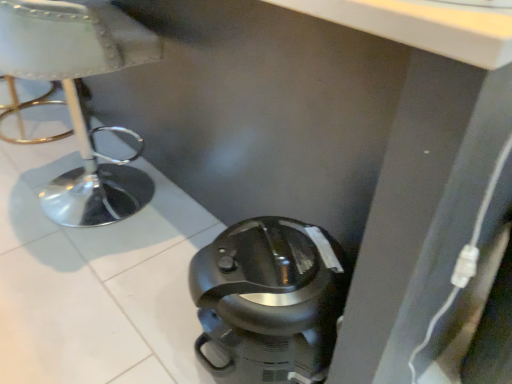
Question: Is white leather stool at left located outside black plastic coffee pot at lower center?

Choices:
 (A) yes
 (B) no

Answer: (A)

Question: Is white leather stool at left in front of black plastic coffee pot at lower center?

Choices:
 (A) yes
 (B) no

Answer: (B)

Question: Would you say white leather stool at left contains black plastic coffee pot at lower center?

Choices:
 (A) yes
 (B) no

Answer: (B)

Question: Is white leather stool at left thinner than black plastic coffee pot at lower center?

Choices:
 (A) yes
 (B) no

Answer: (B)

Question: Does white leather stool at left have a greater height compared to black plastic coffee pot at lower center?

Choices:
 (A) no
 (B) yes

Answer: (B)

Question: Is white leather stool at left turned away from black plastic coffee pot at lower center?

Choices:
 (A) yes
 (B) no

Answer: (B)

Question: Is black plastic coffee pot at lower center directly adjacent to white leather stool at left?

Choices:
 (A) no
 (B) yes

Answer: (A)

Question: Can you confirm if black plastic coffee pot at lower center is thinner than white leather stool at left?

Choices:
 (A) yes
 (B) no

Answer: (A)

Question: From a real-world perspective, is black plastic coffee pot at lower center located beneath white leather stool at left?

Choices:
 (A) no
 (B) yes

Answer: (B)

Question: Is the depth of black plastic coffee pot at lower center greater than that of white leather stool at left?

Choices:
 (A) no
 (B) yes

Answer: (A)

Question: Can you confirm if black plastic coffee pot at lower center is positioned to the right of white leather stool at left?

Choices:
 (A) yes
 (B) no

Answer: (A)

Question: From the image's perspective, is black plastic coffee pot at lower center above white leather stool at left?

Choices:
 (A) yes
 (B) no

Answer: (B)

Question: From a real-world perspective, relative to white leather stool at left, is black plastic coffee pot at lower center vertically above or below?

Choices:
 (A) above
 (B) below

Answer: (B)